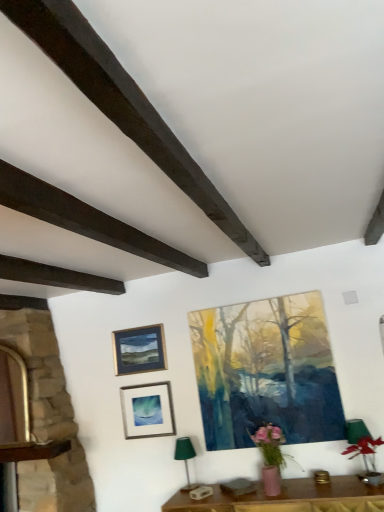
Question: Can you confirm if matte glass picture frame at lower center, placed as the 2th picture frame when sorted from left to right, is positioned to the left of matte acrylic painting at center, the first picture frame from the right?

Choices:
 (A) yes
 (B) no

Answer: (A)

Question: Is matte glass picture frame at lower center, which is counted as the 2th picture frame, starting from the right, completely or partially outside of matte acrylic painting at center, the first picture frame from the right?

Choices:
 (A) yes
 (B) no

Answer: (A)

Question: Is matte glass picture frame at lower center, which is counted as the 2th picture frame, starting from the right, surrounding matte acrylic painting at center, the first picture frame from the right?

Choices:
 (A) no
 (B) yes

Answer: (A)

Question: Is matte glass picture frame at lower center, which is counted as the 2th picture frame, starting from the right, behind matte acrylic painting at center, the third picture frame in the left-to-right sequence?

Choices:
 (A) no
 (B) yes

Answer: (B)

Question: From the image's perspective, is matte glass picture frame at lower center, which is counted as the 2th picture frame, starting from the right, above matte acrylic painting at center, the first picture frame from the right?

Choices:
 (A) yes
 (B) no

Answer: (B)

Question: Is matte glass picture frame at lower center, which is counted as the 2th picture frame, starting from the right, not close to matte acrylic painting at center, the third picture frame in the left-to-right sequence?

Choices:
 (A) no
 (B) yes

Answer: (A)

Question: Is green fabric lampshade at lower center taller than dark brown wood at upper left, which is counted as the second plank, starting from the left?

Choices:
 (A) yes
 (B) no

Answer: (A)

Question: Would you say green fabric lampshade at lower center is outside dark brown wood at upper left, which is the first plank in right-to-left order?

Choices:
 (A) yes
 (B) no

Answer: (A)

Question: Is green fabric lampshade at lower center far from dark brown wood at upper left, which is counted as the second plank, starting from the left?

Choices:
 (A) yes
 (B) no

Answer: (A)

Question: Can you confirm if green fabric lampshade at lower center is shorter than dark brown wood at upper left, which is counted as the second plank, starting from the left?

Choices:
 (A) yes
 (B) no

Answer: (B)

Question: Does green fabric lampshade at lower center touch dark brown wood at upper left, which is counted as the second plank, starting from the left?

Choices:
 (A) yes
 (B) no

Answer: (B)

Question: Is green fabric lampshade at lower center to the right of dark brown wood at upper left, which is counted as the second plank, starting from the left, from the viewer's perspective?

Choices:
 (A) yes
 (B) no

Answer: (B)

Question: Is dark brown wood at upper left, which is the first plank in left-to-right order, not within green fabric lampshade at lower center?

Choices:
 (A) yes
 (B) no

Answer: (A)